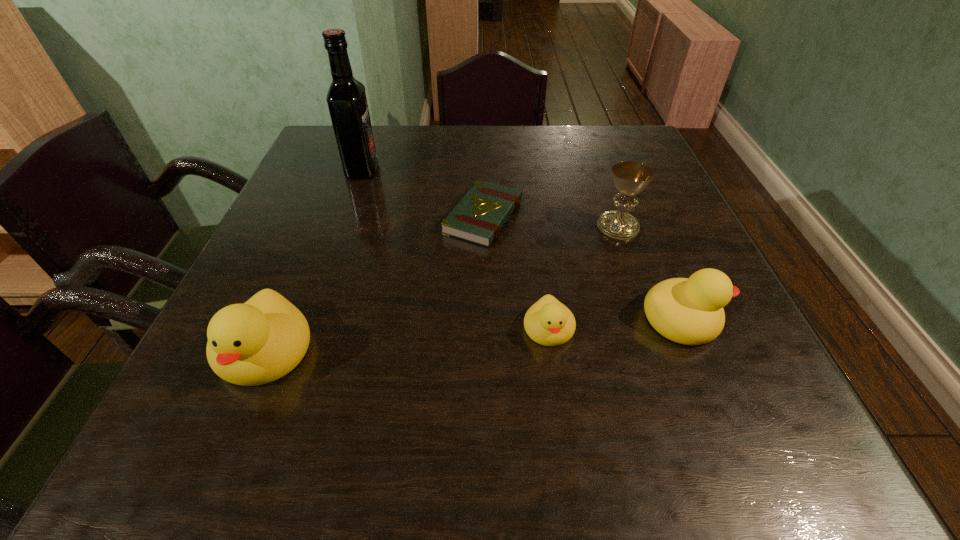
You are a GUI agent. You are given a task and a screenshot of the screen. Output one action in this format:
    pyautogui.click(x=<x>, y=<y>)
    Task: Click on the empty space between the leftmost duckling and the shortest object
    
    Given the screenshot: What is the action you would take?
    pyautogui.click(x=374, y=284)

The image size is (960, 540). What are the coordinates of `vacant region between the second duckling from left to right and the chalice` in the screenshot? It's located at (584, 278).

In order to click on free space that is in between the third shortest object and the leftmost duckling in this screenshot , I will do `click(473, 335)`.

Where is `empty space between the leftmost duckling and the farthest object`? empty space between the leftmost duckling and the farthest object is located at coordinates (313, 261).

In order to click on free space between the liquor and the book in this screenshot , I will do `click(422, 193)`.

Locate an element on the screen. object identified as the closest to the chalice is located at coordinates (690, 311).

Where is `the fourth closest object to the chalice`? The height and width of the screenshot is (540, 960). the fourth closest object to the chalice is located at coordinates (346, 98).

Identify which duckling is located as the nearest to the tallest object. Please provide its 2D coordinates. Your answer should be formatted as a tuple, i.e. [(x, y)], where the tuple contains the x and y coordinates of a point satisfying the conditions above.

[(257, 342)]

Locate an element on the screen. The width and height of the screenshot is (960, 540). duckling that is the second closest to the leftmost duckling is located at coordinates (690, 311).

Where is `free space that satisfies the following two spatial constraints: 1. on the face of the second shortest duckling; 2. on the face of the shortest duckling`? The height and width of the screenshot is (540, 960). free space that satisfies the following two spatial constraints: 1. on the face of the second shortest duckling; 2. on the face of the shortest duckling is located at coordinates (686, 329).